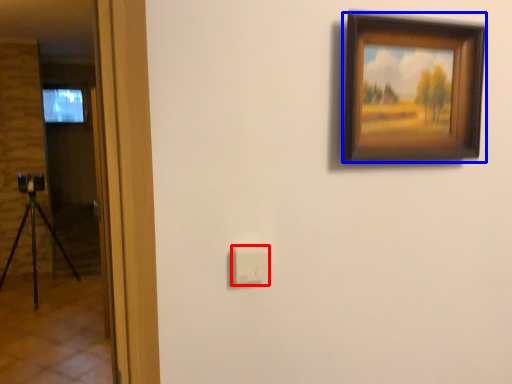
Question: Which object is further to the camera taking this photo, light switch (highlighted by a red box) or picture frame (highlighted by a blue box)?

Choices:
 (A) light switch
 (B) picture frame

Answer: (A)